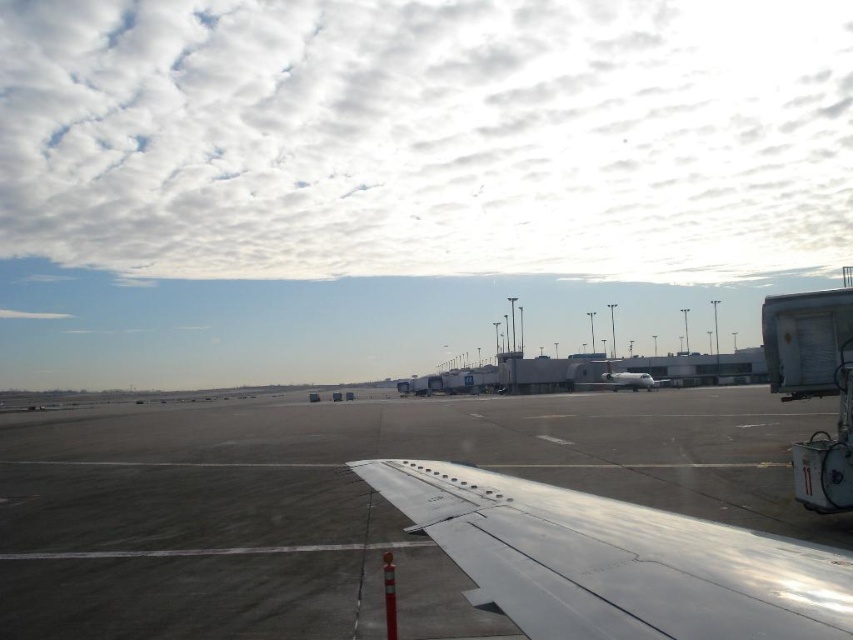
Who is shorter, silver metallic wing at center or white metallic airplane at center?

silver metallic wing at center is shorter.

Which is more to the left, silver metallic wing at center or white metallic airplane at center?

Positioned to the left is silver metallic wing at center.

This screenshot has height=640, width=853. What are the coordinates of `silver metallic wing at center` in the screenshot? It's located at (614, 561).

Locate an element on the screen. silver metallic wing at center is located at coordinates (614, 561).

Can you confirm if cloudy sky at upper center is positioned to the right of silver metallic wing at center?

Result: Incorrect, cloudy sky at upper center is not on the right side of silver metallic wing at center.

Is point (263, 60) in front of point (419, 467)?

No.

Where is `cloudy sky at upper center`? cloudy sky at upper center is located at coordinates (427, 136).

How distant is cloudy sky at upper center from white metallic airplane at center?

A distance of 231.52 feet exists between cloudy sky at upper center and white metallic airplane at center.

The image size is (853, 640). What do you see at coordinates (427, 136) in the screenshot?
I see `cloudy sky at upper center` at bounding box center [427, 136].

Identify the location of cloudy sky at upper center. This screenshot has width=853, height=640. (427, 136).

At what (x,y) coordinates should I click in order to perform the action: click on cloudy sky at upper center. Please return your answer as a coordinate pair (x, y). This screenshot has height=640, width=853. Looking at the image, I should click on (427, 136).